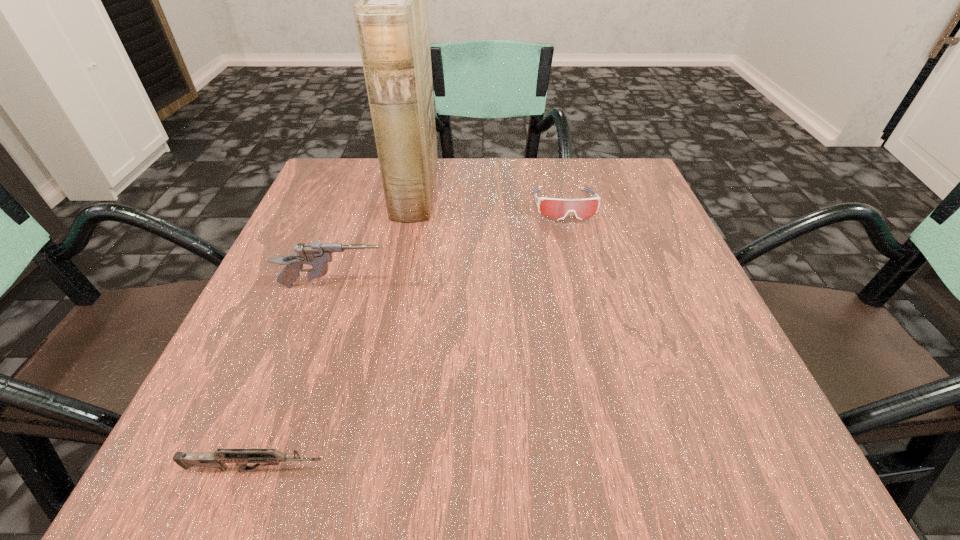
Find the location of `phonebook that is at the far edge`. phonebook that is at the far edge is located at coordinates (391, 18).

The image size is (960, 540). Find the location of `goggles that is positioned at the far edge`. goggles that is positioned at the far edge is located at coordinates (583, 209).

I want to click on object at the near edge, so click(x=217, y=460).

Find the location of a particular element. The width and height of the screenshot is (960, 540). object that is at the right edge is located at coordinates (583, 209).

Where is `object at the near left corner`? The image size is (960, 540). object at the near left corner is located at coordinates (217, 460).

At what (x,y) coordinates should I click in order to perform the action: click on object present at the far right corner. Please return your answer as a coordinate pair (x, y). Image resolution: width=960 pixels, height=540 pixels. Looking at the image, I should click on (583, 209).

Locate an element on the screen. This screenshot has height=540, width=960. free region at the far edge of the desktop is located at coordinates (436, 176).

The width and height of the screenshot is (960, 540). Identify the location of free region at the near edge of the desktop. (551, 475).

Where is `vacant region at the left edge of the desktop`? The image size is (960, 540). vacant region at the left edge of the desktop is located at coordinates (321, 368).

Find the location of `free space at the right edge of the desktop`. free space at the right edge of the desktop is located at coordinates (661, 392).